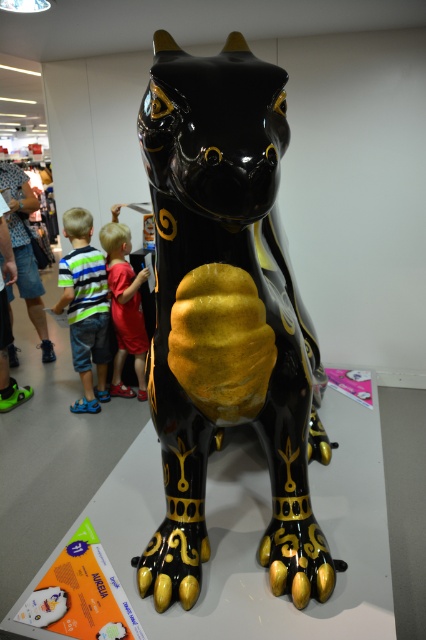
Does glossy black and gold statue at center come in front of red shirt at center?

Yes, glossy black and gold statue at center is closer to the viewer.

Image resolution: width=426 pixels, height=640 pixels. What do you see at coordinates (227, 316) in the screenshot?
I see `glossy black and gold statue at center` at bounding box center [227, 316].

Between point (198, 300) and point (108, 253), which one is positioned in front?

Point (198, 300) is in front.

In order to click on glossy black and gold statue at center in this screenshot , I will do `click(227, 316)`.

Identify the location of glossy black and gold statue at center. (227, 316).

Based on the photo, who is shorter, glossy black and gold statue at center or striped fabric shirt at lower left?

Standing shorter between the two is striped fabric shirt at lower left.

Locate an element on the screen. glossy black and gold statue at center is located at coordinates (227, 316).

I want to click on glossy black and gold statue at center, so click(x=227, y=316).

Which is more to the left, striped fabric shirt at lower left or red shirt at center?

striped fabric shirt at lower left is more to the left.

Does striped fabric shirt at lower left appear on the left side of red shirt at center?

Yes, striped fabric shirt at lower left is to the left of red shirt at center.

Find the location of a particular element. striped fabric shirt at lower left is located at coordinates (86, 307).

Find the location of `striped fabric shirt at lower left`. striped fabric shirt at lower left is located at coordinates (86, 307).